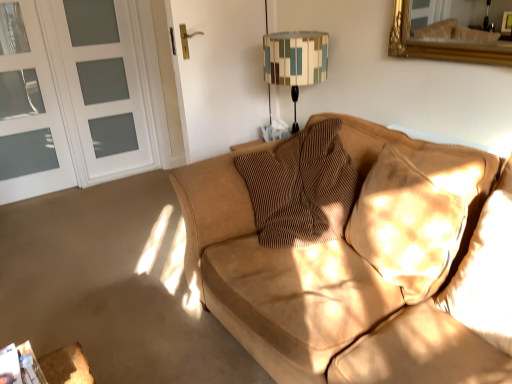
Question: Considering the positions of point (25, 44) and point (293, 52), is point (25, 44) closer or farther from the camera than point (293, 52)?

Choices:
 (A) farther
 (B) closer

Answer: (A)

Question: In the image, is white glass screen door at left, placed as the 1th screen door when sorted from left to right, positioned in front of or behind geometric fabric lampshade at upper center?

Choices:
 (A) behind
 (B) front

Answer: (A)

Question: Estimate the real-world distances between objects in this image. Which object is farther from the suede pillow at right, positioned as the second pillow in right-to-left order?

Choices:
 (A) suede pillow at right, which ranks as the third pillow in left-to-right order
 (B) brown textured pillow at center, which is the 3th pillow from right to left
 (C) geometric fabric lampshade at upper center
 (D) white frosted glass screen door at left, which ranks as the first screen door in right-to-left order
 (E) white glass screen door at left, placed as the 1th screen door when sorted from left to right

Answer: (E)

Question: Which of these objects is positioned closest to the white frosted glass screen door at left, which is the 2th screen door in left-to-right order?

Choices:
 (A) geometric fabric lampshade at upper center
 (B) brown textured pillow at center, which is the 3th pillow from right to left
 (C) white glass screen door at left, placed as the 1th screen door when sorted from left to right
 (D) suede pillow at right, the first pillow from the right
 (E) suede pillow at right, which is the second pillow from left to right

Answer: (C)